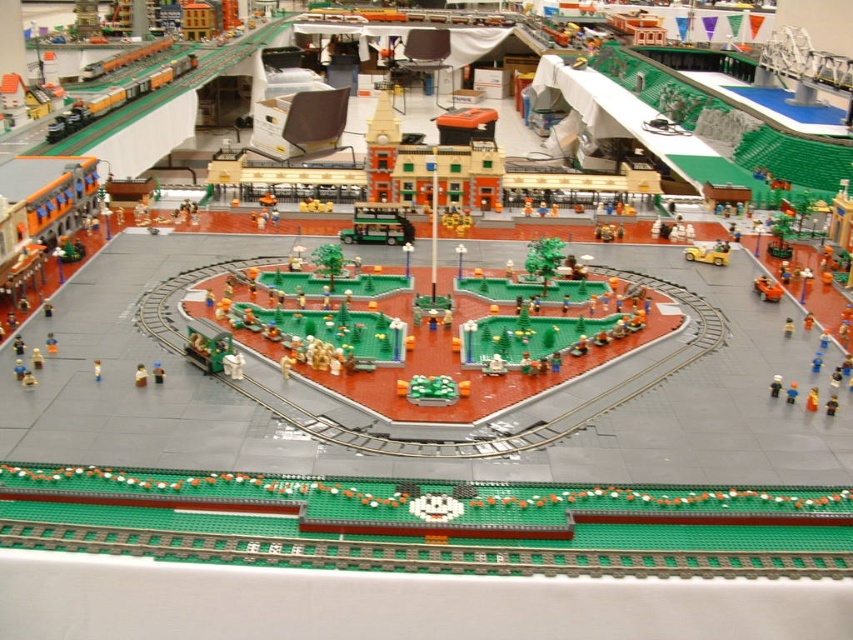
Question: Which of the following is the closest to the observer?

Choices:
 (A) light brown plastic minifigure at lower center
 (B) yellow matte car at center

Answer: (A)

Question: Estimate the real-world distances between objects in this image. Which object is farther from the light brown plastic minifigure at lower center?

Choices:
 (A) shiny orange car at center
 (B) yellow matte car at center

Answer: (B)

Question: Among these points, which one is nearest to the camera?

Choices:
 (A) (134, 378)
 (B) (711, 256)
 (C) (94, 378)
 (D) (346, 228)

Answer: (C)

Question: Can you confirm if yellow matte car at center is wider than light brown plastic minifigure at lower center?

Choices:
 (A) yes
 (B) no

Answer: (A)

Question: Does shiny orange car at center have a lesser width compared to light brown plastic minifigure at lower center?

Choices:
 (A) yes
 (B) no

Answer: (B)

Question: Does green matte bus at center lie behind matte yellow figure at center?

Choices:
 (A) no
 (B) yes

Answer: (B)